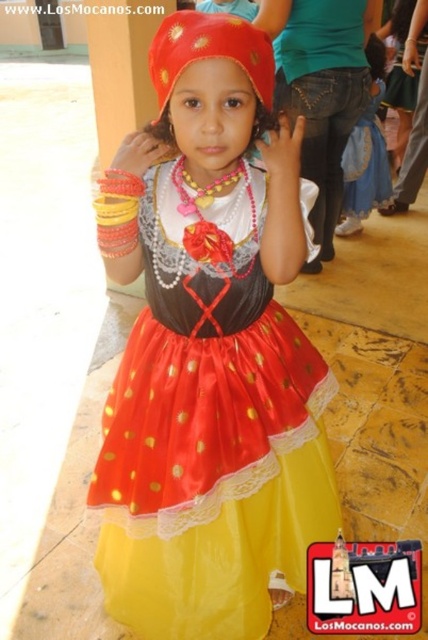
Question: Which of the following is the closest to the observer?

Choices:
 (A) (187, 65)
 (B) (287, 412)

Answer: (A)

Question: Is shiny satin dress at center bigger than matte satin headscarf at center?

Choices:
 (A) no
 (B) yes

Answer: (B)

Question: Which point appears farthest from the camera in this image?

Choices:
 (A) click(234, 310)
 (B) click(163, 90)

Answer: (A)

Question: Is shiny satin dress at center positioned before matte satin headscarf at center?

Choices:
 (A) no
 (B) yes

Answer: (A)

Question: In this image, where is shiny satin dress at center located relative to matte satin headscarf at center?

Choices:
 (A) above
 (B) below

Answer: (B)